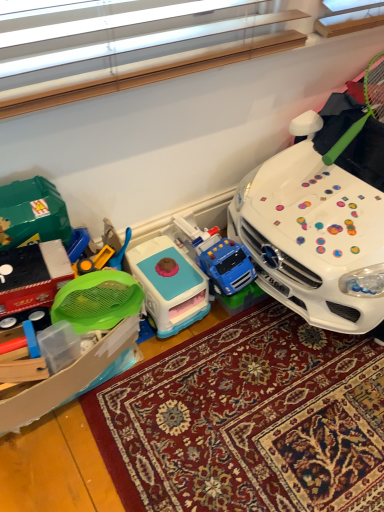
Question: Is the position of carpeted rug at center more distant than that of green mesh strainer at left, which is the first toy from left to right?

Choices:
 (A) yes
 (B) no

Answer: (A)

Question: Is carpeted rug at center positioned with its back to green mesh strainer at left, the third toy when ordered from right to left?

Choices:
 (A) no
 (B) yes

Answer: (A)

Question: Considering the relative sizes of carpeted rug at center and green mesh strainer at left, which is the first toy from left to right, in the image provided, is carpeted rug at center wider than green mesh strainer at left, which is the first toy from left to right,?

Choices:
 (A) no
 (B) yes

Answer: (B)

Question: Is carpeted rug at center aimed at green mesh strainer at left, the third toy when ordered from right to left?

Choices:
 (A) yes
 (B) no

Answer: (B)

Question: Would you say carpeted rug at center is outside green mesh strainer at left, the third toy when ordered from right to left?

Choices:
 (A) yes
 (B) no

Answer: (A)

Question: Is point [x=152, y=280] positioned closer to the camera than point [x=261, y=396]?

Choices:
 (A) closer
 (B) farther

Answer: (B)

Question: From their relative heights in the image, would you say blue plastic play kitchen at center, which is the second toy in right-to-left order, is taller or shorter than carpeted rug at center?

Choices:
 (A) tall
 (B) short

Answer: (A)

Question: In terms of width, does blue plastic play kitchen at center, which is the second toy in right-to-left order, look wider or thinner when compared to carpeted rug at center?

Choices:
 (A) thin
 (B) wide

Answer: (A)

Question: From a real-world perspective, is blue plastic play kitchen at center, which is the second toy in right-to-left order, above or below carpeted rug at center?

Choices:
 (A) below
 (B) above

Answer: (B)

Question: Choose the correct answer: Is blue plastic play kitchen at center, which is the second toy in right-to-left order, inside green mesh strainer at left, the third toy when ordered from right to left, or outside it?

Choices:
 (A) outside
 (B) inside

Answer: (A)

Question: Considering the positions of blue plastic play kitchen at center, arranged as the 2th toy when viewed from the left, and green mesh strainer at left, the third toy when ordered from right to left, in the image, is blue plastic play kitchen at center, arranged as the 2th toy when viewed from the left, bigger or smaller than green mesh strainer at left, the third toy when ordered from right to left,?

Choices:
 (A) big
 (B) small

Answer: (B)

Question: Is blue plastic play kitchen at center, which is the second toy in right-to-left order, in front of or behind green mesh strainer at left, the third toy when ordered from right to left, in the image?

Choices:
 (A) front
 (B) behind

Answer: (B)

Question: From their relative heights in the image, would you say blue plastic play kitchen at center, which is the second toy in right-to-left order, is taller or shorter than green mesh strainer at left, which is the first toy from left to right?

Choices:
 (A) short
 (B) tall

Answer: (A)

Question: Considering the positions of point (94, 284) and point (304, 184), is point (94, 284) closer or farther from the camera than point (304, 184)?

Choices:
 (A) farther
 (B) closer

Answer: (B)

Question: From the image's perspective, relative to white glossy car at right, which appears as the third toy when viewed from the left, is green mesh strainer at left, the third toy when ordered from right to left, above or below?

Choices:
 (A) above
 (B) below

Answer: (B)